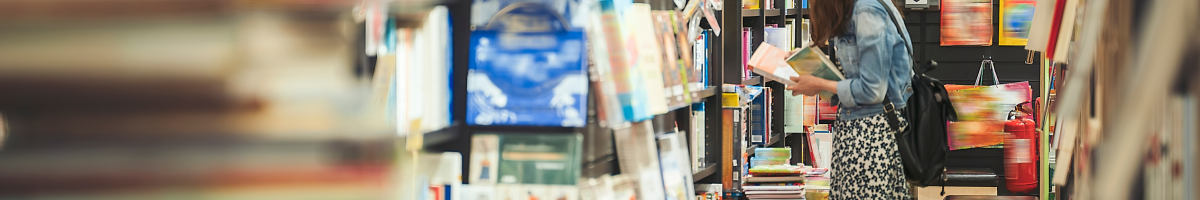
Where is `fire extinguisher`? fire extinguisher is located at coordinates (1018, 165).